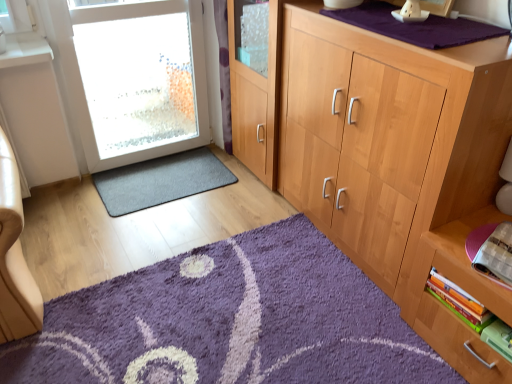
Describe the element at coordinates (391, 160) in the screenshot. Image resolution: width=512 pixels, height=384 pixels. I see `light wood cabinet at center right` at that location.

Measure the distance between point [450,293] and camera.

The depth of point [450,293] is 1.44 meters.

The image size is (512, 384). Describe the element at coordinates (499, 338) in the screenshot. I see `green matte book at lower right, the 3th book in the top-to-bottom sequence` at that location.

Where is `light wood cabinet at center right`? light wood cabinet at center right is located at coordinates (391, 160).

Is light wood cabinet at center right facing away from white frosted glass door at left?

No, light wood cabinet at center right is not facing away from white frosted glass door at left.

Locate an element on the screen. cabinetry that is below the white frosted glass door at left (from the image's perspective) is located at coordinates click(391, 160).

Are light wood cabinet at center right and white frosted glass door at left beside each other?

No, light wood cabinet at center right is not making contact with white frosted glass door at left.

Is the depth of light wood cabinet at center right greater than that of white frosted glass door at left?

That is False.

From a real-world perspective, which is physically above, light wood cabinet at center right or hardcover book at lower right, acting as the second book starting from the bottom?

light wood cabinet at center right is physically above.

From the image's perspective, is light wood cabinet at center right above hardcover book at lower right, acting as the second book starting from the bottom?

Correct, light wood cabinet at center right appears higher than hardcover book at lower right, acting as the second book starting from the bottom, in the image.

Does light wood cabinet at center right have a lesser height compared to hardcover book at lower right, which is the 2th book from top to bottom?

No.

Could you measure the distance between wooden books at lower right and green matte book at lower right, which is the first book from bottom to top?

They are 18.50 centimeters apart.

Does point (479, 356) appear closer or farther from the camera than point (511, 351)?

Point (479, 356) appears to be farther away from the viewer than point (511, 351).

Considering the sizes of objects wooden books at lower right and green matte book at lower right, the 3th book in the top-to-bottom sequence, in the image provided, who is wider, wooden books at lower right or green matte book at lower right, the 3th book in the top-to-bottom sequence,?

With larger width is wooden books at lower right.

Is wooden books at lower right spatially inside green matte book at lower right, which is the first book from bottom to top, or outside of it?

wooden books at lower right cannot be found inside green matte book at lower right, which is the first book from bottom to top.

Considering the sizes of objects green matte book at lower right, which is the first book from bottom to top, and wooden books at lower right in the image provided, who is shorter, green matte book at lower right, which is the first book from bottom to top, or wooden books at lower right?

With less height is green matte book at lower right, which is the first book from bottom to top.

Which is less distant, (508, 330) or (483, 286)?

The point (483, 286) is closer.

Is the position of green matte book at lower right, which is the first book from bottom to top, less distant than that of wooden books at lower right?

That is False.

Consider the image. From the image's perspective, is green matte book at lower right, the 3th book in the top-to-bottom sequence, positioned above or below wooden books at lower right?

From the image's perspective, green matte book at lower right, the 3th book in the top-to-bottom sequence, appears below wooden books at lower right.

The height and width of the screenshot is (384, 512). Identify the location of door on the left of purple shaggy rug at lower center, which appears as the 1th doormat when ordered from the bottom. (132, 76).

In the scene shown: Does white frosted glass door at left have a larger size compared to purple shaggy rug at lower center, which appears as the 1th doormat when ordered from the bottom?

Correct, white frosted glass door at left is larger in size than purple shaggy rug at lower center, which appears as the 1th doormat when ordered from the bottom.

Considering the relative sizes of white frosted glass door at left and purple shaggy rug at lower center, the second doormat positioned from the back, in the image provided, is white frosted glass door at left thinner than purple shaggy rug at lower center, the second doormat positioned from the back,?

Correct, the width of white frosted glass door at left is less than that of purple shaggy rug at lower center, the second doormat positioned from the back.

Which is less distant, (186, 170) or (167, 341)?

Point (186, 170) is farther from the camera than point (167, 341).

Which is more to the right, dark gray carpet at lower left, acting as the 2th doormat starting from the front, or purple shaggy rug at lower center, the 1th doormat viewed from the front?

Positioned to the right is purple shaggy rug at lower center, the 1th doormat viewed from the front.

Which object is further away from the camera taking this photo, dark gray carpet at lower left, the 1th doormat in the back-to-front sequence, or purple shaggy rug at lower center, the second doormat positioned from the back?

dark gray carpet at lower left, the 1th doormat in the back-to-front sequence, is behind.

Is dark gray carpet at lower left, which is the first doormat in top-to-bottom order, taller than purple shaggy rug at lower center, the 1th doormat viewed from the front?

No, dark gray carpet at lower left, which is the first doormat in top-to-bottom order, is not taller than purple shaggy rug at lower center, the 1th doormat viewed from the front.

Which object is more forward, light wood cabinet at center right or wooden books at lower right?

wooden books at lower right is closer to the camera.

From the image's perspective, is light wood cabinet at center right beneath wooden books at lower right?

Actually, light wood cabinet at center right appears above wooden books at lower right in the image.

Considering the relative positions of light wood cabinet at center right and wooden books at lower right in the image provided, is light wood cabinet at center right to the right of wooden books at lower right from the viewer's perspective?

No.

From a real-world perspective, relative to wooden books at lower right, is light wood cabinet at center right vertically above or below?

Clearly, from a real-world perspective, light wood cabinet at center right is above wooden books at lower right.

Locate an element on the screen. The height and width of the screenshot is (384, 512). door above the light wood cabinet at center right (from the image's perspective) is located at coordinates (132, 76).

Locate an element on the screen. This screenshot has width=512, height=384. cabinetry in front of the hardcover book at lower right, which is the 2th book from top to bottom is located at coordinates (391, 160).

From the image, which object appears to be farther from hardcover book at lower right, which appears as the 3th book when ordered from the bottom, light wood cabinet at center right or dark gray carpet at lower left, the second doormat when ordered from bottom to top?

Among the two, dark gray carpet at lower left, the second doormat when ordered from bottom to top, is located further to hardcover book at lower right, which appears as the 3th book when ordered from the bottom.

Estimate the real-world distances between objects in this image. Which object is closer to wooden books at lower right, purple shaggy rug at lower center, the second doormat positioned from the back, or light wood cabinet at center right?

light wood cabinet at center right lies closer to wooden books at lower right than the other object.

Considering their positions, is light wood cabinet at center right positioned closer to wooden books at lower right than green matte book at lower right, which is the first book from bottom to top?

green matte book at lower right, which is the first book from bottom to top.

Which object lies nearer to the anchor point dark gray carpet at lower left, which is the first doormat in top-to-bottom order, green matte book at lower right, the 3th book in the top-to-bottom sequence, or white frosted glass door at left?

white frosted glass door at left lies closer to dark gray carpet at lower left, which is the first doormat in top-to-bottom order, than the other object.

In the scene shown: From the image, which object appears to be farther from hardcover book at lower right, acting as the second book starting from the bottom, wooden books at lower right or light wood cabinet at center right?

light wood cabinet at center right is positioned further to the anchor hardcover book at lower right, acting as the second book starting from the bottom.

Considering their positions, is white frosted glass door at left positioned further to hardcover book at lower right, acting as the second book starting from the bottom, than wooden books at lower right?

white frosted glass door at left is further to hardcover book at lower right, acting as the second book starting from the bottom.

Looking at the image, which one is located further to green matte book at lower right, the 3th book in the top-to-bottom sequence, light wood cabinet at center right or white frosted glass door at left?

white frosted glass door at left lies further to green matte book at lower right, the 3th book in the top-to-bottom sequence, than the other object.

Based on their spatial positions, is light wood cabinet at center right or dark gray carpet at lower left, the 1th doormat in the back-to-front sequence, closer to green matte book at lower right, which is the first book from bottom to top?

Among the two, light wood cabinet at center right is located nearer to green matte book at lower right, which is the first book from bottom to top.

At what (x,y) coordinates should I click in order to perform the action: click on book between light wood cabinet at center right and hardcover book at lower right, acting as the second book starting from the bottom, in the vertical direction. Please return your answer as a coordinate pair (x, y). Looking at the image, I should click on (493, 252).

Where is `cabinetry between purple shaggy rug at lower center, which appears as the 1th doormat when ordered from the bottom, and hardcover book at lower right, acting as the second book starting from the bottom`? The image size is (512, 384). cabinetry between purple shaggy rug at lower center, which appears as the 1th doormat when ordered from the bottom, and hardcover book at lower right, acting as the second book starting from the bottom is located at coordinates (391, 160).

Locate an element on the screen. The image size is (512, 384). cabinetry situated between white frosted glass door at left and wooden books at lower right from left to right is located at coordinates (391, 160).

Locate an element on the screen. cabinetry between dark gray carpet at lower left, the 1th doormat in the back-to-front sequence, and hardcover book at lower right, which appears as the 3th book when ordered from the bottom, in the horizontal direction is located at coordinates (391, 160).